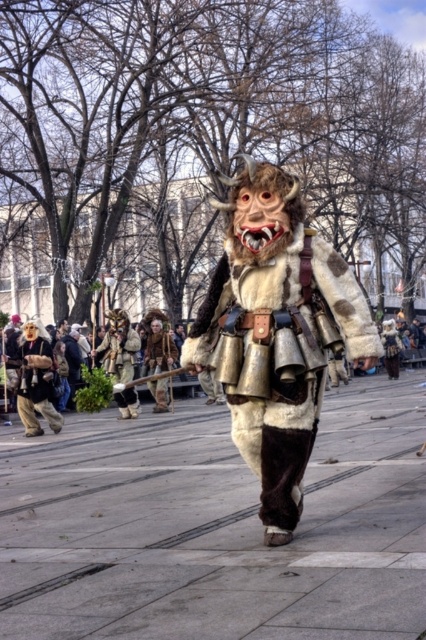
Is concrete paving at center behind furry costume at center?

No, it is not.

Can you confirm if concrete paving at center is positioned to the right of furry costume at center?

No, concrete paving at center is not to the right of furry costume at center.

The width and height of the screenshot is (426, 640). Find the location of `concrete paving at center`. concrete paving at center is located at coordinates (215, 525).

This screenshot has width=426, height=640. I want to click on concrete paving at center, so click(x=215, y=525).